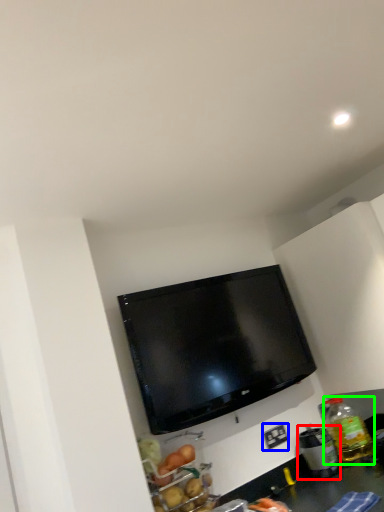
Question: Which object is the farthest from appliance (highlighted by a red box)? Choose among these: electric outlet (highlighted by a blue box) or bottle (highlighted by a green box).

Choices:
 (A) electric outlet
 (B) bottle

Answer: (A)